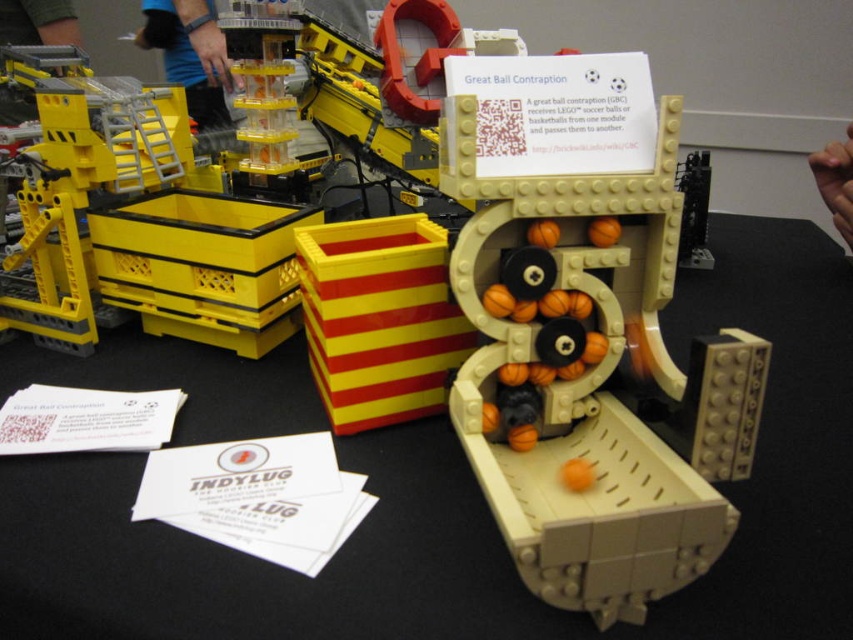
You are looking at the LEGO Great Ball Contraption. Where is the beige plastic table at center located in terms of its 2D coordinates?

The beige plastic table at center is located at the 2D coordinates point (480,508).

You are organizing a LEGO exhibition and need to place a beige plastic table at center and a yellow plastic container at left. Given the space constraints, which object requires more floor space?

The beige plastic table at center requires more floor space because it is bigger than the yellow plastic container at left.

You are standing in front of the LEGO Great Ball Contraption and want to know how far a specific point on the structure is from your eyes. The point is labeled as point (6,540) in the image. Can you determine the distance of this point from your eyes?

The distance of point (6,540) from the camera is 17.66 inches.